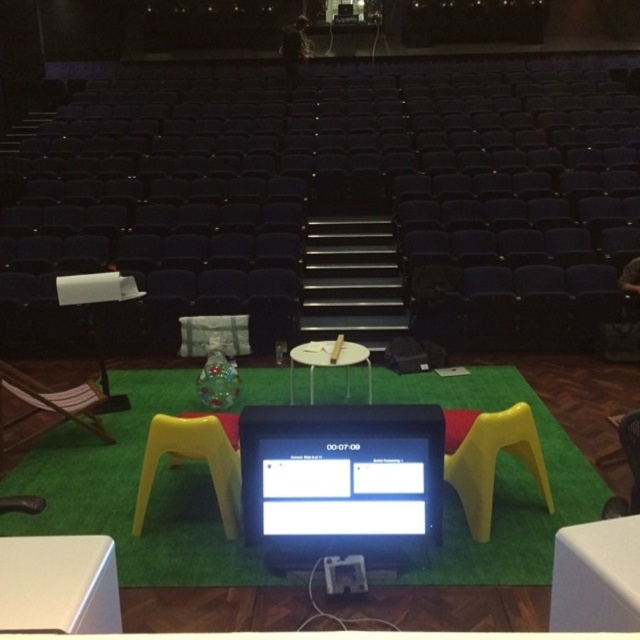
Consider the image. Is white plastic table at lower right above wooden chair at lower right?

Actually, white plastic table at lower right is below wooden chair at lower right.

Is white plastic table at lower right below wooden chair at lower right?

Indeed, white plastic table at lower right is positioned under wooden chair at lower right.

Describe the element at coordinates (596, 577) in the screenshot. I see `white plastic table at lower right` at that location.

Locate an element on the screen. The height and width of the screenshot is (640, 640). white plastic table at lower right is located at coordinates (596, 577).

Is matte black monitor at center below white plastic table at lower left?

Yes, matte black monitor at center is below white plastic table at lower left.

Is point (384, 513) behind point (74, 609)?

Yes.

The width and height of the screenshot is (640, 640). Find the location of `matte black monitor at center`. matte black monitor at center is located at coordinates click(340, 481).

Find the location of `green artificial turf at center`. green artificial turf at center is located at coordinates (134, 493).

Where is `green artificial turf at center`? Image resolution: width=640 pixels, height=640 pixels. green artificial turf at center is located at coordinates (134, 493).